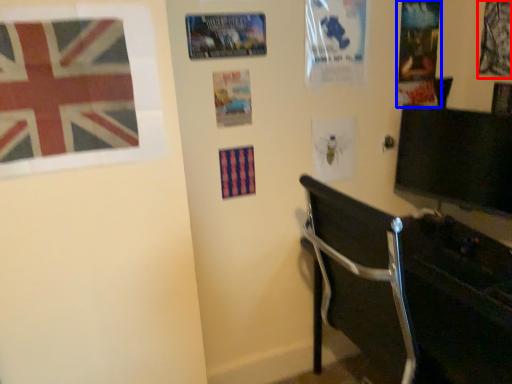
Question: Which of the following is the closest to the observer, poster page (highlighted by a red box) or poster page (highlighted by a blue box)?

Choices:
 (A) poster page
 (B) poster page

Answer: (A)